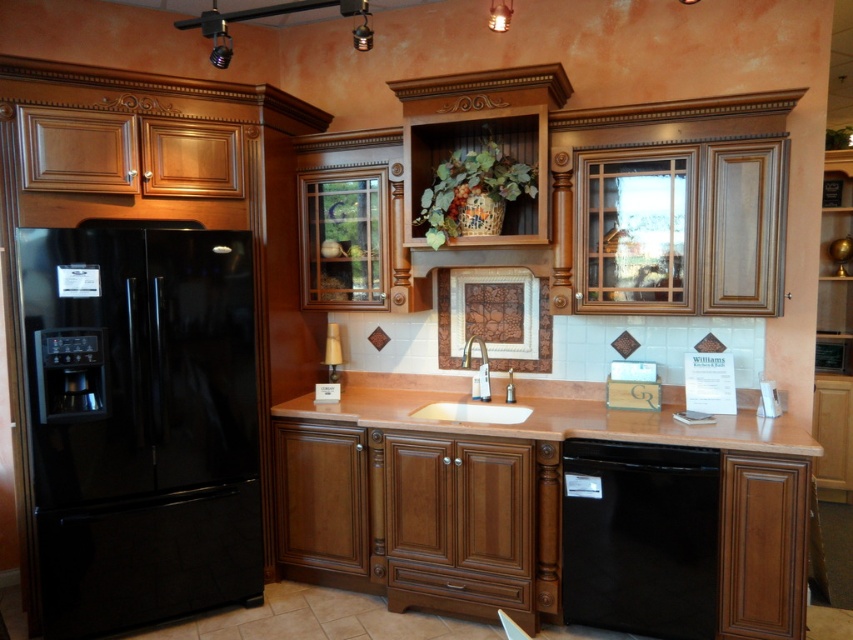
You are standing in the kitchen showroom and want to take a closer look at the black refrigerator on the left. If you move forward 5 feet, will the point at coordinate point [735,433] become closer than 4 feet to you?

The point at coordinate point [735,433] is initially 8.94 feet away from the camera. Moving forward 5 feet reduces the distance to 3.94 feet, which is less than 4 feet. Therefore, yes, the point will be closer than 4 feet after moving forward.

You are standing in the kitchen and want to reach both the point at coordinates (241, 420) and the point at coordinates (598, 481). Which point should you aim for first if you want to touch the one closer to you?

You should aim for point (241, 420) first because it is closer to you than point (598, 481).

You are standing in the kitchen showroom and want to place a decorative item on the countertop. You have two points marked on the countertop at coordinates point (448, 426) and point (437, 406). Which point is closer to you so that the decoration will be more visible?

Point (448, 426) is closer to the viewer than point (437, 406), so placing the decorative item there would make it more visible.